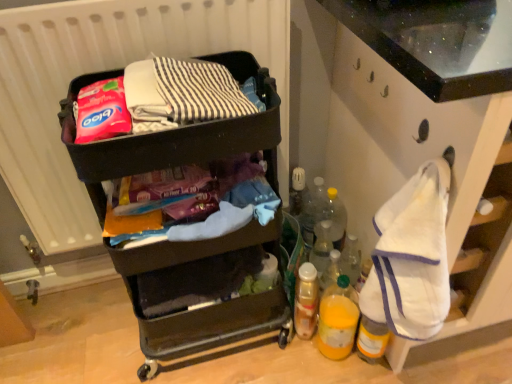
Identify the location of vacant space situated on the left part of translucent plastic spray can at lower center, placed as the 2th bottle when sorted from bottom to top. The image size is (512, 384). (258, 339).